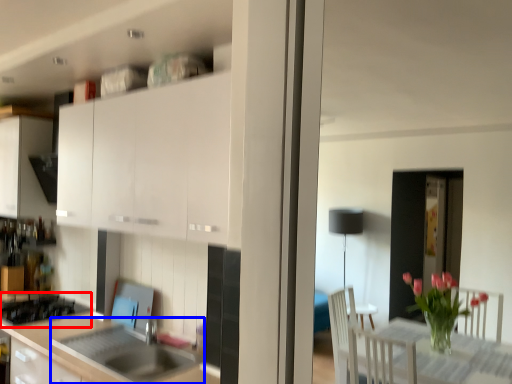
Question: Which object is further to the camera taking this photo, gas stove (highlighted by a red box) or sink (highlighted by a blue box)?

Choices:
 (A) gas stove
 (B) sink

Answer: (A)